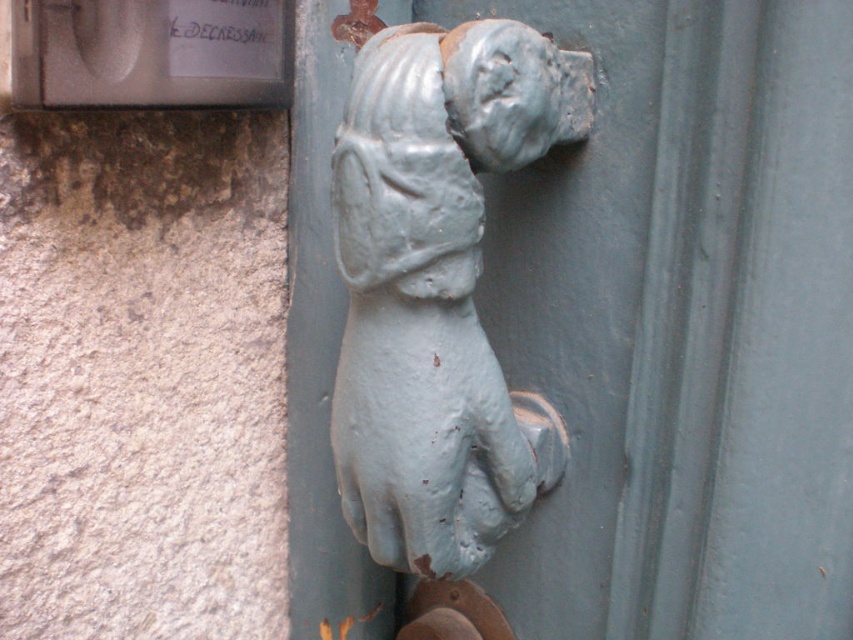
You are standing in front of a door with a light blue painted metal dog knocker at center. You want to touch the knocker without moving your hand from its current position. Is your hand within reach of the light blue painted metal dog at center?

The light blue painted metal dog at center is 17.56 inches away from the viewer. Since the average human hand can typically reach about 18 inches, your hand is within reach of the light blue painted metal dog at center.